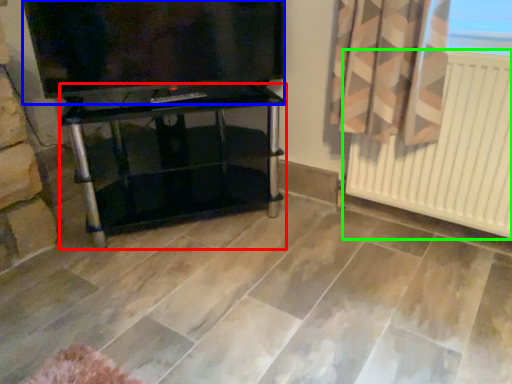
Question: Which object is the closest to the furniture (highlighted by a red box)? Choose among these: television (highlighted by a blue box) or radiator (highlighted by a green box).

Choices:
 (A) television
 (B) radiator

Answer: (A)